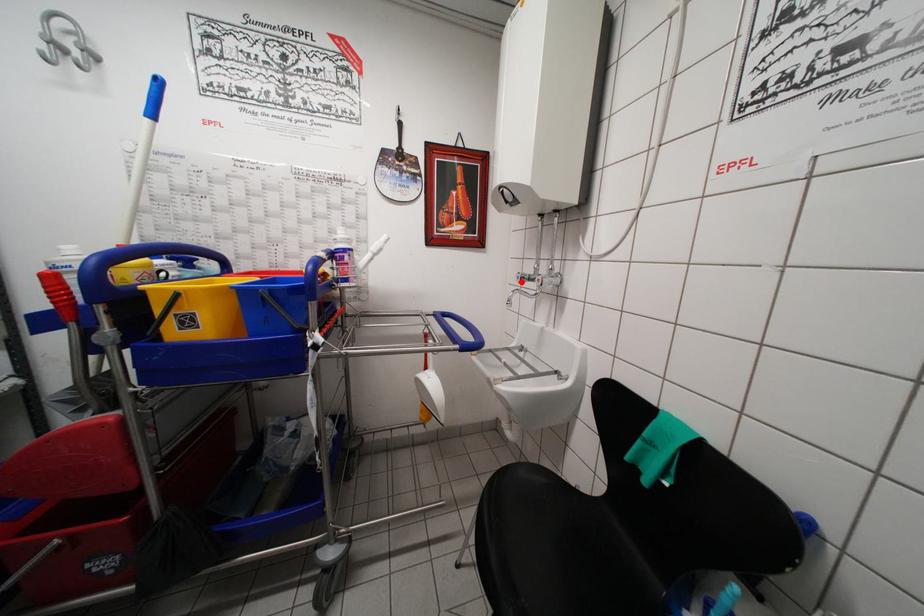
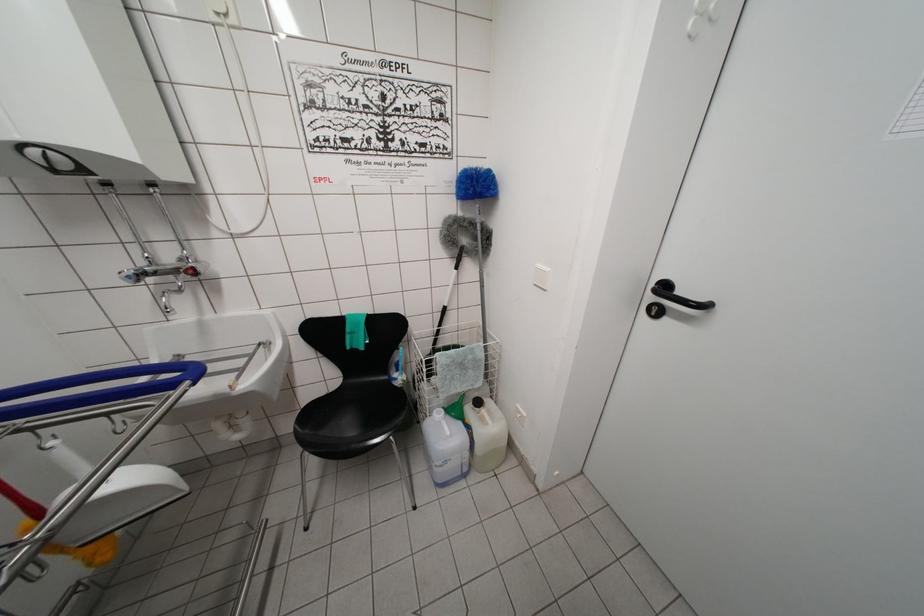
Where in the second image is the point corresponding to the highlighted location from the first image?

(131, 282)